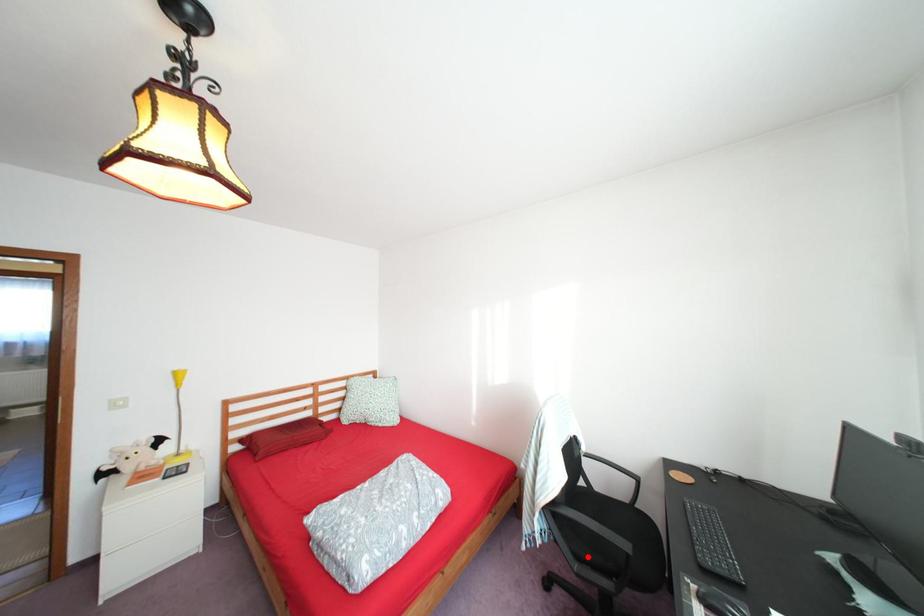
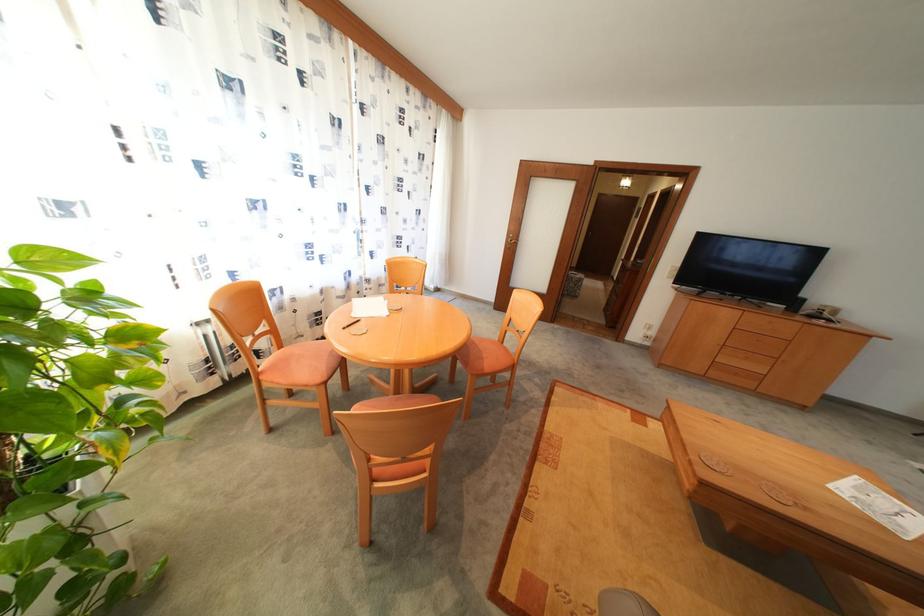
Question: I am providing you with two images of the same scene from different viewpoints. A red point is marked on the first image. At the location where the point appears in image 1, is it still visible in image 2?

Choices:
 (A) Yes
 (B) No

Answer: (B)